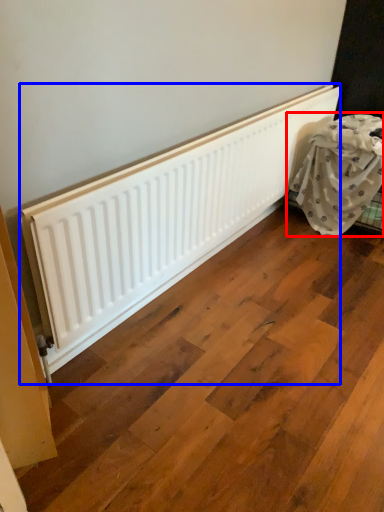
Question: Which point is closer to the camera, furniture (highlighted by a red box) or radiator (highlighted by a blue box)?

Choices:
 (A) furniture
 (B) radiator

Answer: (B)